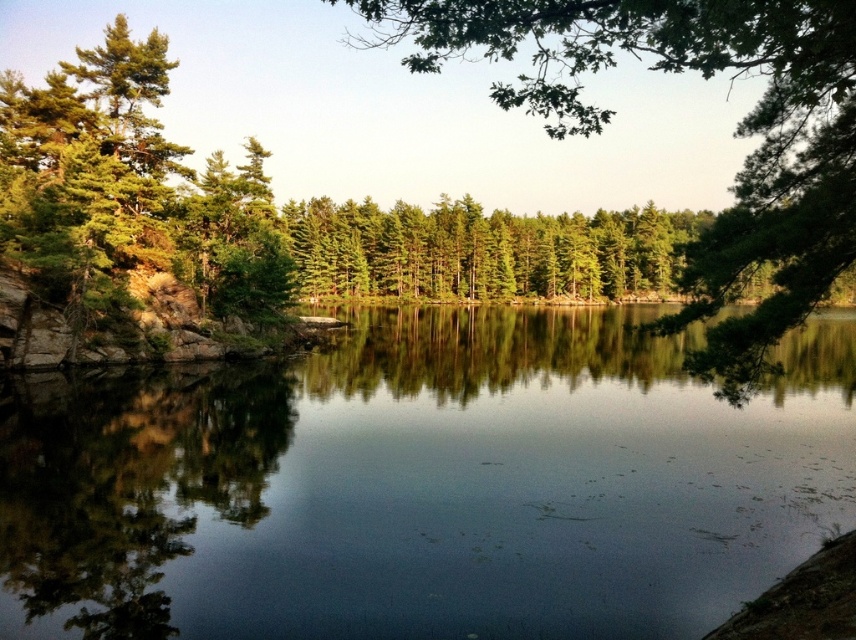
Question: Among these points, which one is farthest from the camera?

Choices:
 (A) (75, 413)
 (B) (415, 262)

Answer: (B)

Question: Based on their relative distances, which object is farther from the green matte tree at upper center?

Choices:
 (A) clear water at center
 (B) green matte trees at center

Answer: (A)

Question: Considering the real-world distances, which object is farthest from the clear water at center?

Choices:
 (A) green matte trees at center
 (B) green matte tree at upper center

Answer: (B)

Question: Is clear water at center to the right of green matte trees at center from the viewer's perspective?

Choices:
 (A) yes
 (B) no

Answer: (B)

Question: Can you confirm if clear water at center is thinner than green matte trees at center?

Choices:
 (A) yes
 (B) no

Answer: (A)

Question: Is green matte tree at upper center positioned before green matte trees at center?

Choices:
 (A) yes
 (B) no

Answer: (A)